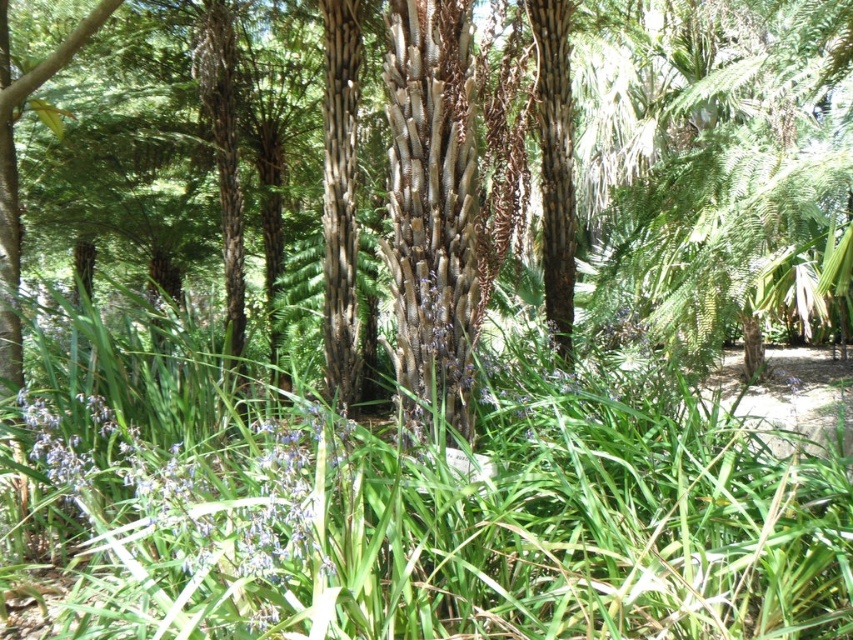
Measure the distance from green leafy grass at center to textured bark palm tree at center.

The distance of green leafy grass at center from textured bark palm tree at center is 3.19 meters.

Who is more forward, (193, 424) or (672, 339)?

Point (193, 424)

The width and height of the screenshot is (853, 640). I want to click on green leafy grass at center, so (x=426, y=515).